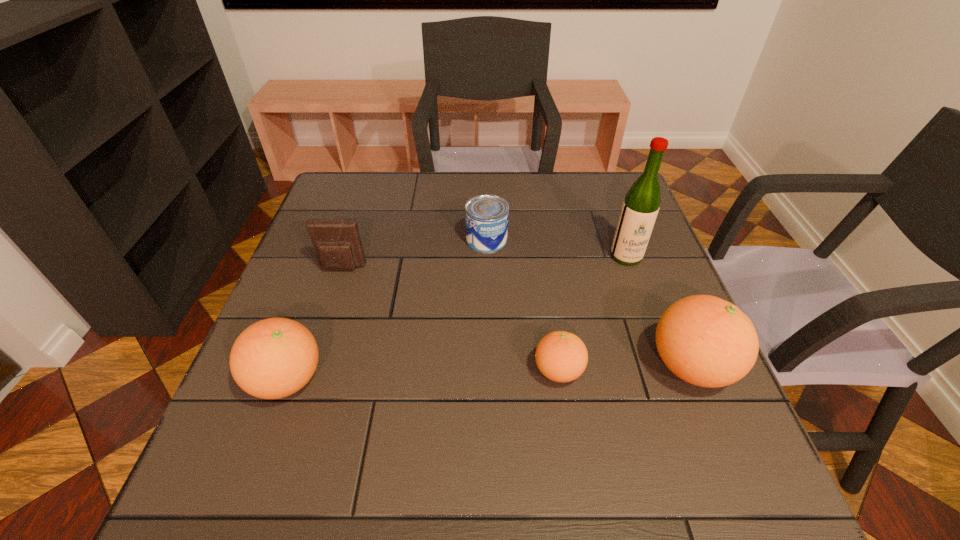
Identify the location of vacant space at the near edge of the desktop. (427, 421).

Where is `vacant area at the right edge`? The image size is (960, 540). vacant area at the right edge is located at coordinates pyautogui.click(x=605, y=232).

In the image, there is a desktop. Where is `free space at the far left corner`? The image size is (960, 540). free space at the far left corner is located at coordinates (365, 176).

The height and width of the screenshot is (540, 960). In the image, there is a desktop. Find the location of `blank space at the far right corner`. blank space at the far right corner is located at coordinates (618, 191).

The image size is (960, 540). Identify the location of free point between the shortest orange and the rightmost orange. (625, 368).

Identify the location of free area in between the can and the liquor. The height and width of the screenshot is (540, 960). (557, 248).

At what (x,y) coordinates should I click in order to perform the action: click on free space between the tallest object and the third object from left to right. Please return your answer as a coordinate pair (x, y). This screenshot has height=540, width=960. Looking at the image, I should click on (557, 248).

The image size is (960, 540). I want to click on unoccupied area between the tallest object and the second tallest orange, so click(x=457, y=318).

Where is `free space between the second orange from left to right and the can`? free space between the second orange from left to right and the can is located at coordinates (522, 305).

Where is `free point between the fourth object from right to left and the pouch`? The height and width of the screenshot is (540, 960). free point between the fourth object from right to left and the pouch is located at coordinates point(415,254).